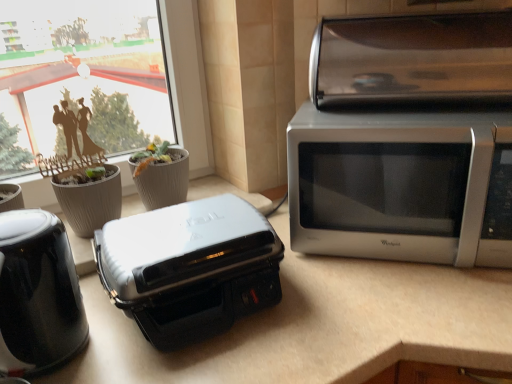
What are the coordinates of `vacant point above satin silver microwave at right (from a real-world perspective)` in the screenshot? It's located at (410, 114).